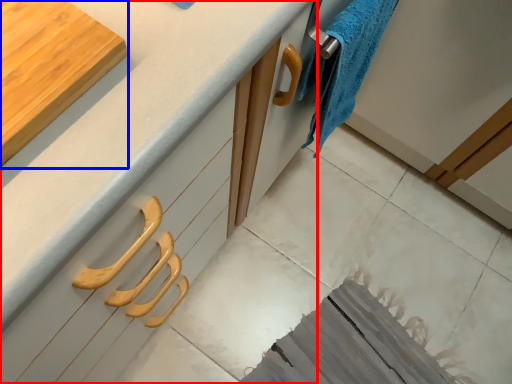
Question: Among these objects, which one is nearest to the camera, countertop (highlighted by a red box) or cutting board (highlighted by a blue box)?

Choices:
 (A) countertop
 (B) cutting board

Answer: (A)